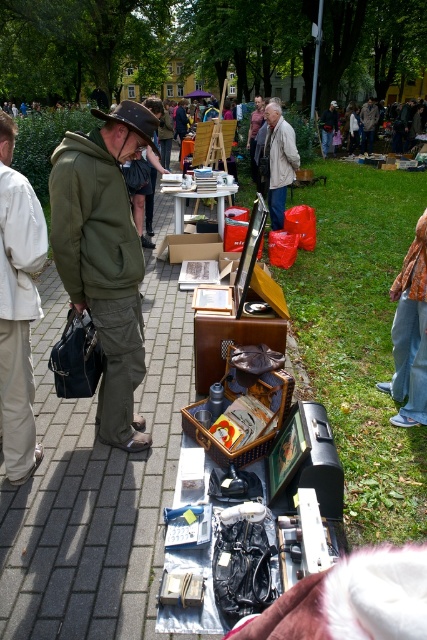
You are a customer at the flea market and see both the matte green jacket at left and the olive green hoodie at left. Which one is taller?

The matte green jacket at left is taller than the olive green hoodie at left.

You are standing at the center of the flea market walkway. You see the olive green hoodie at left. If you want to reach the hoodie, in which direction should you move?

Since the olive green hoodie at left is located at point 0.347 on the x axis and 0.215 on the y axis, you should move to the left to reach it.